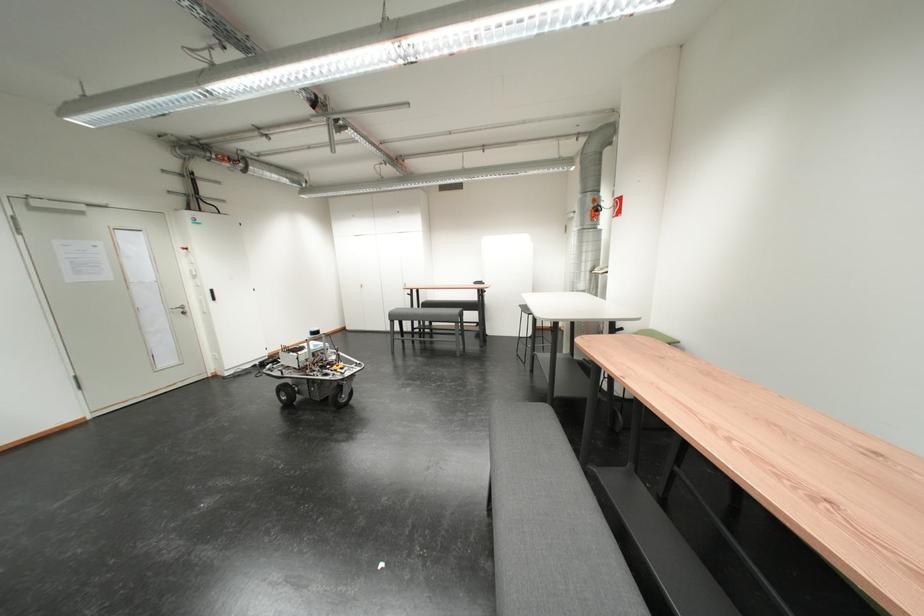
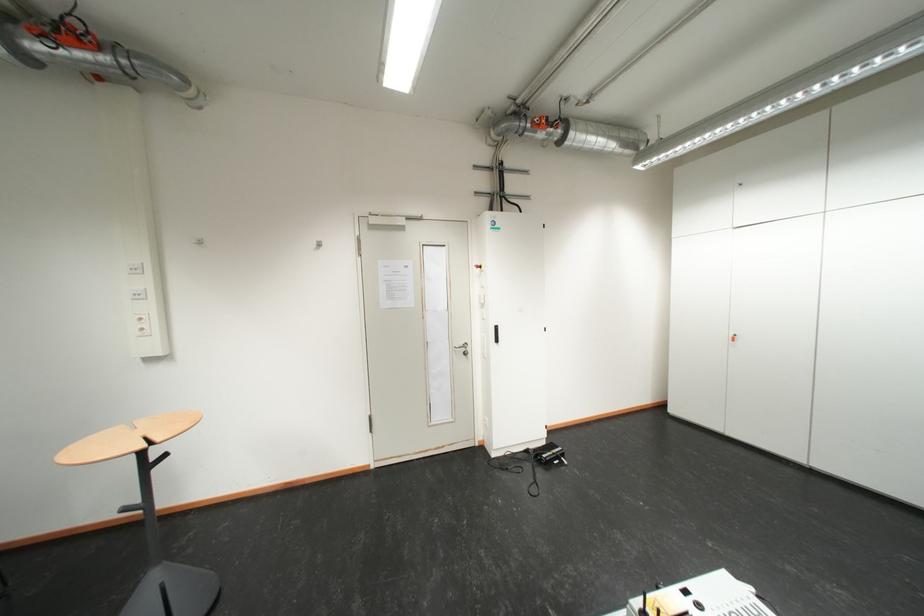
Where in the second image is the point corresponding to [264,368] from the first image?

(538, 454)